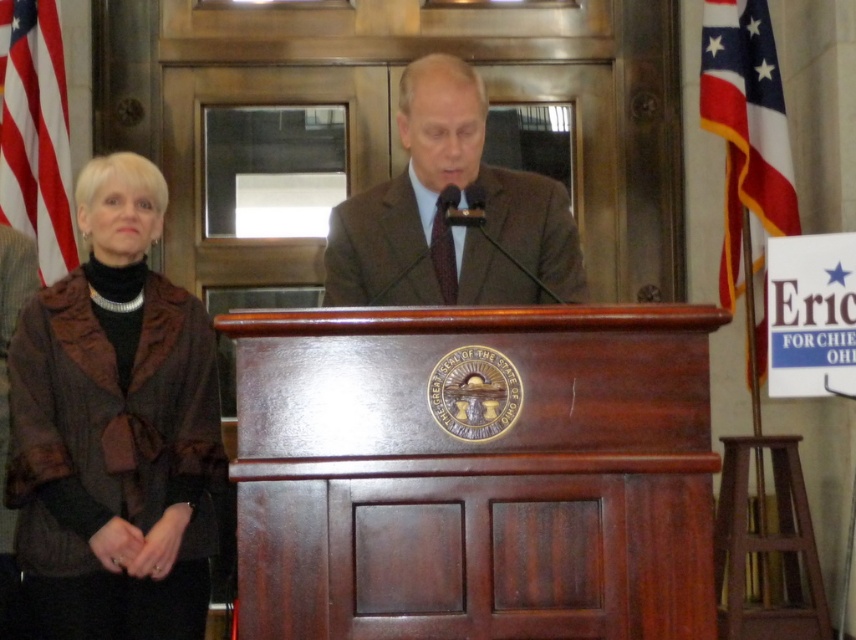
You are an event organizer who needs to ensure that the brown textured suit at center and the red fabric flag at left can both fit on a display table that is 1.2 meters wide. Based on their sizes, will they fit together on the table?

The brown textured suit at center is wider than the red fabric flag at left. If their combined widths exceed 1.2 meters, they may not fit. However, without exact measurements, it is impossible to determine definitively.

You are attending a public speaking event and need to approach the podium. There is a brown textured coat at left and a red fabric flag at left in your way. Which object should you move past first?

The brown textured coat at left is closer to the viewer than the red fabric flag at left, so you should move past the brown textured coat at left first.

You are an event organizer who needs to ensure all items on stage are within the allocated space. Given that the stage has a width limit of 2 meters, and the brown textured coat at left and the red fabric flag at left are both placed on the stage, can you confirm if both items can fit side by side without exceeding the stage width?

The brown textured coat at left is wider than the red fabric flag at left, but without knowing their exact widths, it is impossible to determine if their combined width exceeds the 2 meter limit. Additional measurements are required.